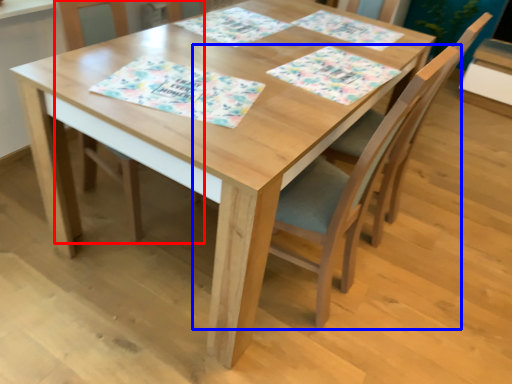
Question: Among these objects, which one is nearest to the camera, chair (highlighted by a red box) or chair (highlighted by a blue box)?

Choices:
 (A) chair
 (B) chair

Answer: (B)